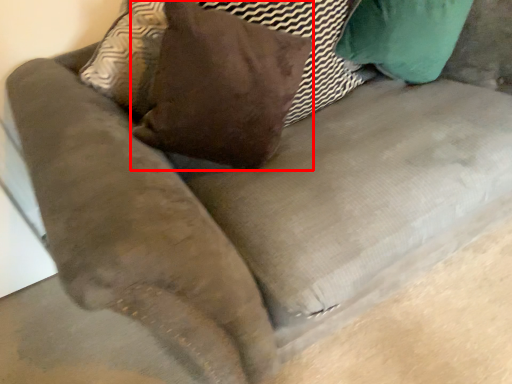
Question: From the image, what is the correct spatial relationship of throw pillow (annotated by the red box) in relation to pillow?

Choices:
 (A) left
 (B) right

Answer: (A)